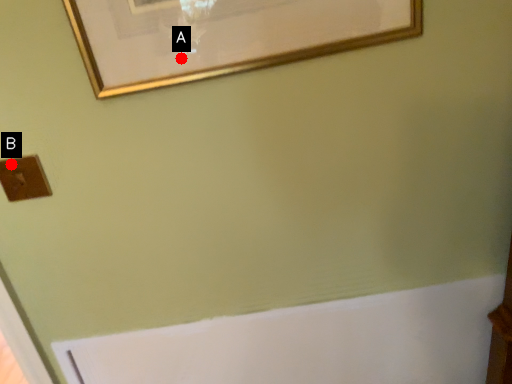
Question: Two points are circled on the image, labeled by A and B beside each circle. Which of the following is the farthest from the observer?

Choices:
 (A) A is further
 (B) B is further

Answer: (B)